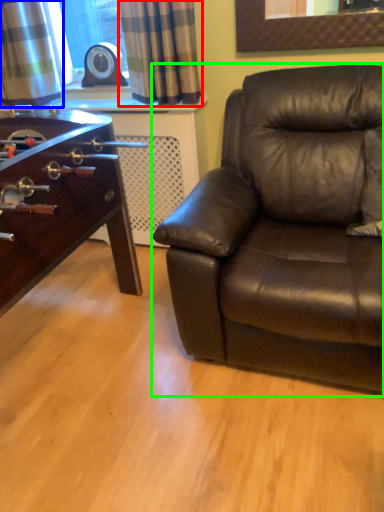
Question: Which is nearer to the curtain (highlighted by a red box)? curtain (highlighted by a blue box) or studio couch (highlighted by a green box).

Choices:
 (A) curtain
 (B) studio couch

Answer: (A)